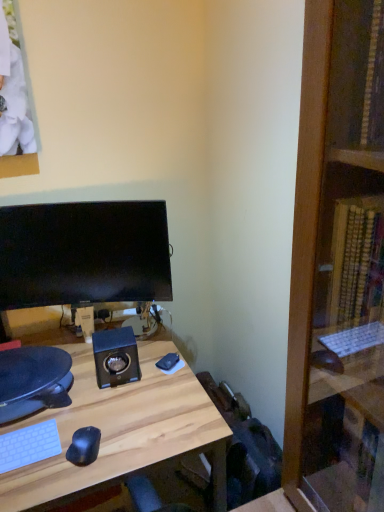
Question: Is light wood desk at center facing towards matte black monitor at center?

Choices:
 (A) no
 (B) yes

Answer: (B)

Question: Can you see light wood desk at center touching matte black monitor at center?

Choices:
 (A) yes
 (B) no

Answer: (B)

Question: Does light wood desk at center have a greater height compared to matte black monitor at center?

Choices:
 (A) yes
 (B) no

Answer: (A)

Question: Does light wood desk at center appear on the left side of matte black monitor at center?

Choices:
 (A) yes
 (B) no

Answer: (B)

Question: From the image's perspective, does light wood desk at center appear lower than matte black monitor at center?

Choices:
 (A) yes
 (B) no

Answer: (A)

Question: From a real-world perspective, does light wood desk at center stand above matte black monitor at center?

Choices:
 (A) yes
 (B) no

Answer: (B)

Question: Is matte black monitor at center positioned far away from light wood desk at center?

Choices:
 (A) yes
 (B) no

Answer: (B)

Question: Considering the relative sizes of matte black monitor at center and light wood desk at center in the image provided, is matte black monitor at center shorter than light wood desk at center?

Choices:
 (A) no
 (B) yes

Answer: (B)

Question: Does matte black monitor at center come in front of light wood desk at center?

Choices:
 (A) no
 (B) yes

Answer: (A)

Question: Is matte black monitor at center aimed at light wood desk at center?

Choices:
 (A) no
 (B) yes

Answer: (B)

Question: Can you confirm if matte black monitor at center is smaller than light wood desk at center?

Choices:
 (A) no
 (B) yes

Answer: (B)

Question: Is matte black monitor at center at the right side of light wood desk at center?

Choices:
 (A) yes
 (B) no

Answer: (B)

Question: Considering the positions of matte black monitor at center and light wood desk at center in the image, is matte black monitor at center wider or thinner than light wood desk at center?

Choices:
 (A) thin
 (B) wide

Answer: (A)